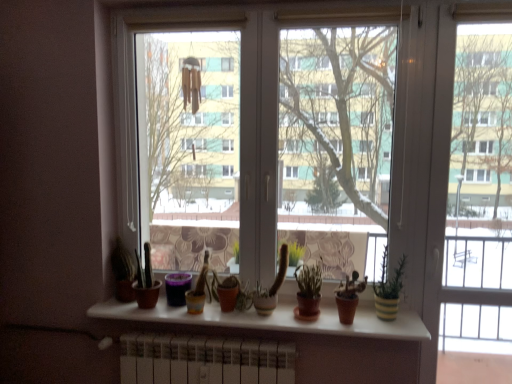
Locate an element on the screen. The width and height of the screenshot is (512, 384). transparent glass window at center is located at coordinates (265, 145).

Identify the location of matte brown pot at center. (227, 297).

In order to face yellow striped pot at right, should I rotate leftwards or rightwards?

You should look right and rotate roughly 17.364 degrees.

This screenshot has width=512, height=384. Describe the element at coordinates (479, 190) in the screenshot. I see `transparent glass screen door at center` at that location.

Where is `white matte window sill at center`? Image resolution: width=512 pixels, height=384 pixels. white matte window sill at center is located at coordinates (272, 319).

Where is `plant on the right side of matte brown pot at center`? Image resolution: width=512 pixels, height=384 pixels. plant on the right side of matte brown pot at center is located at coordinates (309, 280).

Considering the positions of objects matte brown pot at center and green matte plant at center in the image provided, who is more to the right, matte brown pot at center or green matte plant at center?

green matte plant at center.

Would you say matte brown pot at center is inside or outside green matte plant at center?

matte brown pot at center cannot be found inside green matte plant at center.

What's the angular difference between matte brown pot at center and green matte plant at center's facing directions?

The facing directions of matte brown pot at center and green matte plant at center are 1.45 degrees apart.

Based on the photo, what's the angular difference between yellow striped pot at right and transparent glass window at center's facing directions?

There is a 0.368-degree angle between the facing directions of yellow striped pot at right and transparent glass window at center.

Considering the positions of objects yellow striped pot at right and transparent glass window at center in the image provided, who is more to the left, yellow striped pot at right or transparent glass window at center?

transparent glass window at center is more to the left.

From the image's perspective, is yellow striped pot at right located above or below transparent glass window at center?

Based on their image positions, yellow striped pot at right is located beneath transparent glass window at center.

Is point (378, 288) closer or farther from the camera than point (220, 223)?

Point (378, 288).

From the image's perspective, is transparent glass window at center above or below transparent glass screen door at center?

Based on their image positions, transparent glass window at center is located above transparent glass screen door at center.

Is transparent glass window at center shorter than transparent glass screen door at center?

Correct, transparent glass window at center is not as tall as transparent glass screen door at center.

Considering the points (186, 128) and (502, 286), which point is behind, point (186, 128) or point (502, 286)?

The point (186, 128) is more distant.

Which of these two, transparent glass window at center or transparent glass screen door at center, is smaller?

transparent glass screen door at center is smaller.

Which object is closer to the camera, transparent glass window at center or green matte plant at center?

Positioned in front is transparent glass window at center.

Are transparent glass window at center and green matte plant at center located far from each other?

Actually, transparent glass window at center and green matte plant at center are a little close together.

Considering the points (289, 77) and (311, 282), which point is in front, point (289, 77) or point (311, 282)?

The point (311, 282) is closer to the camera.

Does white matte window sill at center turn towards transparent glass window at center?

No, white matte window sill at center is not aimed at transparent glass window at center.

Does white matte window sill at center lie behind transparent glass window at center?

No, the depth of white matte window sill at center is less than that of transparent glass window at center.

Which is closer, (323, 318) or (189, 261)?

Point (323, 318)

Which is more to the right, transparent glass screen door at center or yellow striped pot at right?

transparent glass screen door at center is more to the right.

Is yellow striped pot at right surrounded by transparent glass screen door at center?

That's incorrect, yellow striped pot at right is not inside transparent glass screen door at center.

Which is behind, transparent glass screen door at center or yellow striped pot at right?

yellow striped pot at right is further from the camera.

From the image's perspective, is matte brown pot at center positioned above or below white matte window sill at center?

Clearly, from the image's perspective, matte brown pot at center is above white matte window sill at center.

Is matte brown pot at center far away from white matte window sill at center?

No, matte brown pot at center is not far away from white matte window sill at center.

Is point (232, 295) more distant than point (395, 328)?

That is True.

From the picture: Can you confirm if matte brown pot at center is thinner than white matte window sill at center?

Correct, the width of matte brown pot at center is less than that of white matte window sill at center.

I want to click on plant on the right of the matte brown pot at center, so click(309, 280).

The width and height of the screenshot is (512, 384). Identify the location of glass window positioned vertically above the yellow striped pot at right (from a real-world perspective). (265, 145).

Based on the photo, from the image, which object appears to be nearer to white matte window sill at center, transparent glass window at center or transparent glass screen door at center?

Based on the image, transparent glass screen door at center appears to be nearer to white matte window sill at center.

Which object lies nearer to the anchor point transparent glass screen door at center, matte brown pot at center or white matte window sill at center?

The object closer to transparent glass screen door at center is white matte window sill at center.

Based on their spatial positions, is green matte plant at center or yellow striped pot at right closer to transparent glass window at center?

Based on the image, green matte plant at center appears to be nearer to transparent glass window at center.

Looking at the image, which one is located further to yellow striped pot at right, white matte window sill at center or transparent glass window at center?

Based on the image, transparent glass window at center appears to be further to yellow striped pot at right.

Estimate the real-world distances between objects in this image. Which object is closer to matte brown pot at center, yellow striped pot at right or green matte plant at center?

green matte plant at center is positioned closer to the anchor matte brown pot at center.

Based on their spatial positions, is matte brown pot at center or transparent glass screen door at center closer to yellow striped pot at right?

Among the two, transparent glass screen door at center is located nearer to yellow striped pot at right.

Looking at the image, which one is located further to transparent glass screen door at center, white matte window sill at center or yellow striped pot at right?

Among the two, white matte window sill at center is located further to transparent glass screen door at center.

Estimate the real-world distances between objects in this image. Which object is closer to matte brown pot at center, transparent glass window at center or transparent glass screen door at center?

The object closer to matte brown pot at center is transparent glass window at center.

This screenshot has width=512, height=384. Find the location of `houseplant between transparent glass window at center and transparent glass screen door at center`. houseplant between transparent glass window at center and transparent glass screen door at center is located at coordinates (389, 290).

Find the location of a particular element. The image size is (512, 384). houseplant between matte brown pot at center and transparent glass screen door at center is located at coordinates (389, 290).

Locate an element on the screen. plant between transparent glass window at center and transparent glass screen door at center is located at coordinates (309, 280).

You are a GUI agent. You are given a task and a screenshot of the screen. Output one action in this format:
    pyautogui.click(x=<x>, y=<y>)
    Task: Click on the window sill situated between matte brown pot at center and yellow striped pot at right from left to right
    The image size is (512, 384).
    Given the screenshot: What is the action you would take?
    click(x=272, y=319)